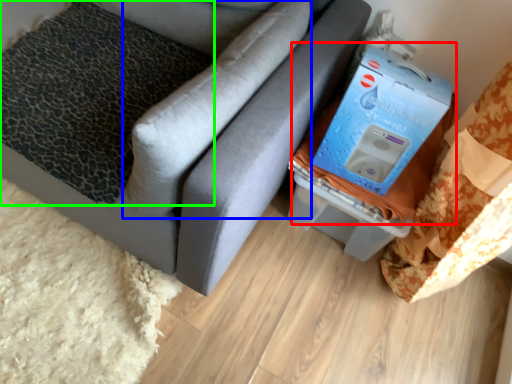
Question: Which object is the closest to the storage box (highlighted by a red box)? Choose among these: pillow (highlighted by a blue box) or pillow (highlighted by a green box).

Choices:
 (A) pillow
 (B) pillow

Answer: (A)